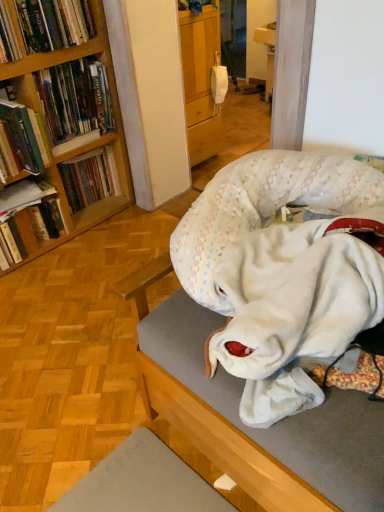
Question: Is hardcover book at left, which is counted as the third book, starting from the bottom, wider than hardcover book at left, which is counted as the third book, starting from the top?

Choices:
 (A) no
 (B) yes

Answer: (A)

Question: From the image's perspective, does hardcover book at left, which is counted as the third book, starting from the bottom, appear higher than hardcover book at left, which is counted as the third book, starting from the top?

Choices:
 (A) yes
 (B) no

Answer: (B)

Question: Is hardcover book at left, the fourth book in the top-to-bottom sequence, next to hardcover book at left, which is counted as the third book, starting from the top, and touching it?

Choices:
 (A) no
 (B) yes

Answer: (A)

Question: From a real-world perspective, is hardcover book at left, the fourth book in the top-to-bottom sequence, physically above hardcover book at left, which is counted as the 4th book, starting from the bottom?

Choices:
 (A) no
 (B) yes

Answer: (A)

Question: Is hardcover book at left, the fourth book in the top-to-bottom sequence, oriented towards hardcover book at left, which is counted as the third book, starting from the top?

Choices:
 (A) no
 (B) yes

Answer: (A)

Question: Looking at the image, does hardcover book at left, which is the 2th book in bottom-to-top order, seem bigger or smaller compared to hardcover books at left, the second book when ordered from top to bottom?

Choices:
 (A) small
 (B) big

Answer: (A)

Question: Is point (14, 183) closer or farther from the camera than point (102, 95)?

Choices:
 (A) closer
 (B) farther

Answer: (A)

Question: From a real-world perspective, relative to hardcover books at left, the second book when ordered from top to bottom, is hardcover book at left, which is the 2th book in bottom-to-top order, vertically above or below?

Choices:
 (A) below
 (B) above

Answer: (A)

Question: Considering the positions of hardcover book at left, which is the 2th book in bottom-to-top order, and hardcover books at left, acting as the fifth book starting from the bottom, in the image, is hardcover book at left, which is the 2th book in bottom-to-top order, wider or thinner than hardcover books at left, acting as the fifth book starting from the bottom,?

Choices:
 (A) thin
 (B) wide

Answer: (B)

Question: From the image's perspective, is hardcover book at left, which is the 2th book in bottom-to-top order, above or below white plush dog bed at center?

Choices:
 (A) above
 (B) below

Answer: (A)

Question: Is hardcover book at left, the fifth book when ordered from top to bottom, to the left or to the right of white plush dog bed at center in the image?

Choices:
 (A) left
 (B) right

Answer: (A)

Question: In terms of size, does hardcover book at left, the fifth book when ordered from top to bottom, appear bigger or smaller than white plush dog bed at center?

Choices:
 (A) big
 (B) small

Answer: (B)

Question: Considering the positions of hardcover book at left, the fifth book when ordered from top to bottom, and white plush dog bed at center in the image, is hardcover book at left, the fifth book when ordered from top to bottom, wider or thinner than white plush dog bed at center?

Choices:
 (A) wide
 (B) thin

Answer: (B)

Question: From the image's perspective, is hardcover book at left, which is counted as the third book, starting from the top, positioned above or below hardcover book at left, which is the 2th book in bottom-to-top order?

Choices:
 (A) below
 (B) above

Answer: (B)

Question: Is hardcover book at left, which is counted as the third book, starting from the top, wider or thinner than hardcover book at left, which is the 2th book in bottom-to-top order?

Choices:
 (A) wide
 (B) thin

Answer: (A)